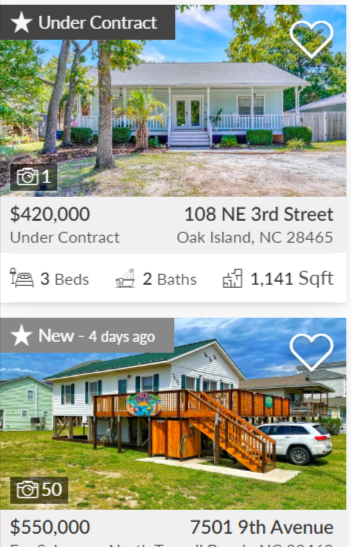
You are a GUI agent. You are given a task and a screenshot of the screen. Output one action in this format:
    pyautogui.click(x=<x>, y=<y>)
    Task: Click on the windows
    
    Given the screenshot: What is the action you would take?
    pyautogui.click(x=245, y=102), pyautogui.click(x=65, y=391), pyautogui.click(x=187, y=380)